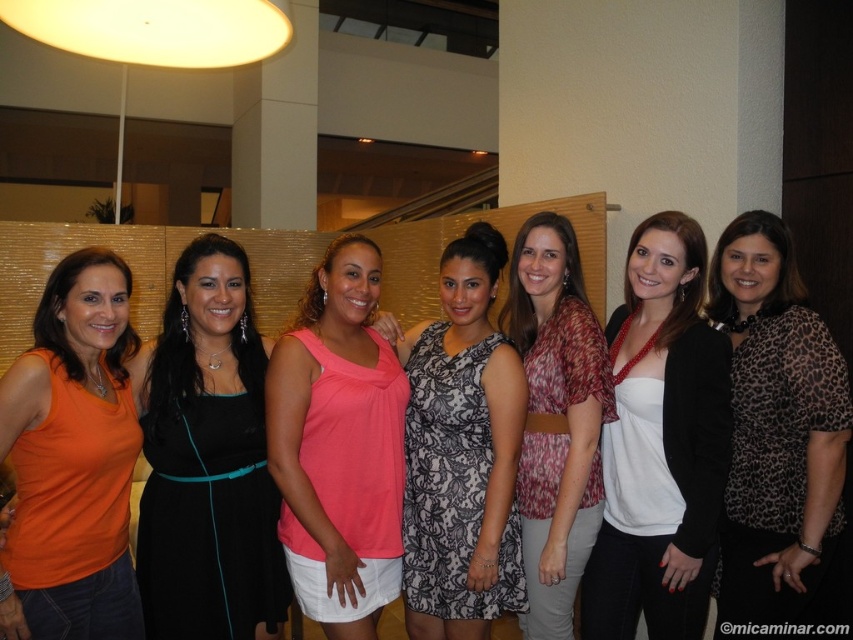
In the scene, there are two women wearing the matte orange tank top at left and the printed fabric blouse at center. Which of these two items of clothing is narrower in width?

The matte orange tank top at left is thinner than the printed fabric blouse at center, so the matte orange tank top at left is narrower in width.

You are standing in the lobby and need to locate two specific points marked in the image. The first point is at coordinates point (x=695, y=452) and the second is at point (x=386, y=374). Which of these two points is nearer to your current position?

Point (x=695, y=452) is closer to the camera than point (x=386, y=374), so the first point is nearer to your current position.